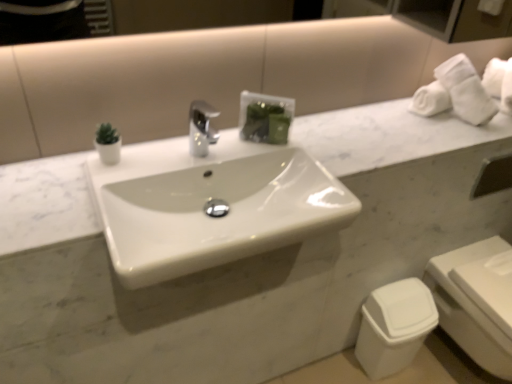
What is the approximate width of white plastic toilet bowl at lower right?

The width of white plastic toilet bowl at lower right is 7.77 inches.

Where is `white plastic toilet bowl at lower right`? The width and height of the screenshot is (512, 384). white plastic toilet bowl at lower right is located at coordinates (394, 326).

In the scene shown: Is white plastic toilet bowl at lower right spatially inside white plastic toilet at lower right, or outside of it?

white plastic toilet bowl at lower right exists outside the volume of white plastic toilet at lower right.

Which object is positioned more to the left, white plastic toilet bowl at lower right or white plastic toilet at lower right?

Positioned to the left is white plastic toilet bowl at lower right.

Is white plastic toilet bowl at lower right positioned with its back to white plastic toilet at lower right?

No, white plastic toilet bowl at lower right is not facing the opposite direction of white plastic toilet at lower right.

Which point is more forward, (422, 303) or (472, 320)?

The point (472, 320) is more forward.

From the image's perspective, does white glossy sink at center appear higher than white plastic toilet bowl at lower right?

Correct, white glossy sink at center appears higher than white plastic toilet bowl at lower right in the image.

Does white glossy sink at center have a smaller size compared to white plastic toilet bowl at lower right?

Incorrect, white glossy sink at center is not smaller in size than white plastic toilet bowl at lower right.

Which is farther from the camera, (210, 180) or (369, 349)?

The point (369, 349) is more distant.

Is white glossy sink at center far away from white plastic toilet bowl at lower right?

white glossy sink at center is near white plastic toilet bowl at lower right, not far away.

Would you say white plastic toilet at lower right is to the left or to the right of white glossy sink at center in the picture?

In the image, white plastic toilet at lower right appears on the right side of white glossy sink at center.

Is the depth of white plastic toilet at lower right less than that of white glossy sink at center?

No, white plastic toilet at lower right is further to the viewer.

From a real-world perspective, between white plastic toilet at lower right and white glossy sink at center, who is vertically higher?

From a 3D spatial view, white glossy sink at center is above.

Considering the positions of objects white glossy sink at center and white plastic toilet at lower right in the image provided, who is in front, white glossy sink at center or white plastic toilet at lower right?

white glossy sink at center is closer to the camera.

Which is in front, point (229, 250) or point (511, 370)?

The point (229, 250) is closer to the camera.

Which is more to the left, white glossy sink at center or white plastic toilet at lower right?

From the viewer's perspective, white glossy sink at center appears more on the left side.

Does white glossy sink at center have a lesser height compared to white plastic toilet at lower right?

Indeed, white glossy sink at center has a lesser height compared to white plastic toilet at lower right.

Would you say white plastic toilet at lower right contains white plastic toilet bowl at lower right?

No, white plastic toilet at lower right does not contain white plastic toilet bowl at lower right.

In the image, is white plastic toilet at lower right on the left side or the right side of white plastic toilet bowl at lower right?

From the image, it's evident that white plastic toilet at lower right is to the right of white plastic toilet bowl at lower right.

Measure the distance from white plastic toilet at lower right to white plastic toilet bowl at lower right.

white plastic toilet at lower right is 7.47 inches away from white plastic toilet bowl at lower right.

Considering the relative sizes of white plastic toilet at lower right and white plastic toilet bowl at lower right in the image provided, is white plastic toilet at lower right thinner than white plastic toilet bowl at lower right?

In fact, white plastic toilet at lower right might be wider than white plastic toilet bowl at lower right.

Which object is closer to the camera, white plastic toilet bowl at lower right or white glossy sink at center?

white glossy sink at center is in front.

Looking at this image, is white plastic toilet bowl at lower right positioned with its back to white glossy sink at center?

No, white glossy sink at center is not at the back of white plastic toilet bowl at lower right.

Is white plastic toilet bowl at lower right situated inside white glossy sink at center or outside?

white plastic toilet bowl at lower right is spatially situated outside white glossy sink at center.

Which object is wider, white plastic toilet bowl at lower right or white glossy sink at center?

Wider between the two is white glossy sink at center.

The width and height of the screenshot is (512, 384). What are the coordinates of `toilet to the right of white plastic toilet bowl at lower right` in the screenshot? It's located at (469, 309).

There is a white plastic toilet bowl at lower right. At what (x,y) coordinates should I click in order to perform the action: click on sink above it (from a real-world perspective). Please return your answer as a coordinate pair (x, y). Looking at the image, I should click on (209, 205).

Based on their spatial positions, is white plastic toilet bowl at lower right or white plastic toilet at lower right further from white glossy sink at center?

The object further to white glossy sink at center is white plastic toilet at lower right.

Estimate the real-world distances between objects in this image. Which object is closer to white plastic toilet bowl at lower right, white plastic toilet at lower right or white glossy sink at center?

white plastic toilet at lower right is closer to white plastic toilet bowl at lower right.

From the image, which object appears to be nearer to white plastic toilet at lower right, white glossy sink at center or white plastic toilet bowl at lower right?

The object closer to white plastic toilet at lower right is white plastic toilet bowl at lower right.

In the scene shown: Considering their positions, is white plastic toilet at lower right positioned closer to white glossy sink at center than white plastic toilet bowl at lower right?

white plastic toilet bowl at lower right is closer to white glossy sink at center.

Looking at the image, which one is located closer to white plastic toilet at lower right, white plastic toilet bowl at lower right or white glossy sink at center?

white plastic toilet bowl at lower right is closer to white plastic toilet at lower right.

When comparing their distances from white plastic toilet bowl at lower right, does white glossy sink at center or white plastic toilet at lower right seem closer?

white plastic toilet at lower right is positioned closer to the anchor white plastic toilet bowl at lower right.

Find the location of a particular element. The height and width of the screenshot is (384, 512). toilet bowl situated between white glossy sink at center and white plastic toilet at lower right from left to right is located at coordinates (394, 326).